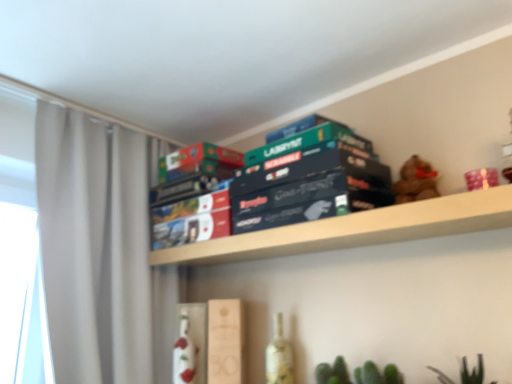
Question: From a real-world perspective, does wooden box at center, the 1th paperback book when ordered from bottom to top, sit lower than green matte plant at lower center, which is the 1th plant in top-to-bottom order?

Choices:
 (A) yes
 (B) no

Answer: (B)

Question: From a real-world perspective, is wooden box at center, the 1th paperback book when ordered from bottom to top, over green matte plant at lower center, which is the second plant from bottom to top?

Choices:
 (A) no
 (B) yes

Answer: (B)

Question: Does wooden box at center, the 1th paperback book when ordered from bottom to top, have a smaller size compared to green matte plant at lower center, which is the 1th plant in top-to-bottom order?

Choices:
 (A) no
 (B) yes

Answer: (A)

Question: Is wooden box at center, the 1th paperback book when ordered from bottom to top, facing towards green matte plant at lower center, which is the second plant from bottom to top?

Choices:
 (A) yes
 (B) no

Answer: (B)

Question: Does wooden box at center, marked as the 4th paperback book in a top-to-bottom arrangement, have a greater height compared to green matte plant at lower center, which is the 1th plant in top-to-bottom order?

Choices:
 (A) no
 (B) yes

Answer: (B)

Question: Does wooden box at center, marked as the 4th paperback book in a top-to-bottom arrangement, come in front of green matte plant at lower center, which is the 1th plant in top-to-bottom order?

Choices:
 (A) yes
 (B) no

Answer: (B)

Question: Is wooden shelf at upper center further to the viewer compared to green matte board game at center, positioned as the 2th paperback book in bottom-to-top order?

Choices:
 (A) yes
 (B) no

Answer: (B)

Question: Considering the relative sizes of wooden shelf at upper center and green matte board game at center, positioned as the 2th paperback book in bottom-to-top order, in the image provided, is wooden shelf at upper center thinner than green matte board game at center, positioned as the 2th paperback book in bottom-to-top order,?

Choices:
 (A) no
 (B) yes

Answer: (A)

Question: Considering the relative sizes of wooden shelf at upper center and green matte board game at center, marked as the 3th paperback book in a top-to-bottom arrangement, in the image provided, is wooden shelf at upper center wider than green matte board game at center, marked as the 3th paperback book in a top-to-bottom arrangement,?

Choices:
 (A) no
 (B) yes

Answer: (B)

Question: Is green matte board game at center, marked as the 3th paperback book in a top-to-bottom arrangement, located within wooden shelf at upper center?

Choices:
 (A) no
 (B) yes

Answer: (A)

Question: Does wooden shelf at upper center appear on the right side of green matte board game at center, marked as the 3th paperback book in a top-to-bottom arrangement?

Choices:
 (A) yes
 (B) no

Answer: (B)

Question: Is wooden shelf at upper center positioned before green matte board game at center, positioned as the 2th paperback book in bottom-to-top order?

Choices:
 (A) no
 (B) yes

Answer: (B)

Question: Considering the relative sizes of dark blue cardboard game box at center and green matte board game at center, positioned as the 2th paperback book in bottom-to-top order, in the image provided, is dark blue cardboard game box at center thinner than green matte board game at center, positioned as the 2th paperback book in bottom-to-top order,?

Choices:
 (A) no
 (B) yes

Answer: (A)